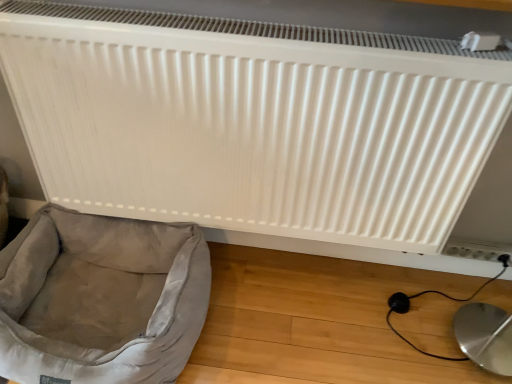
Question: Does white plastic electric outlet at lower right have a greater height compared to light gray fabric dog bed at lower left?

Choices:
 (A) yes
 (B) no

Answer: (B)

Question: Can you confirm if white plastic electric outlet at lower right is positioned to the right of light gray fabric dog bed at lower left?

Choices:
 (A) yes
 (B) no

Answer: (A)

Question: From the image's perspective, is white plastic electric outlet at lower right located beneath light gray fabric dog bed at lower left?

Choices:
 (A) no
 (B) yes

Answer: (A)

Question: Is the depth of white plastic electric outlet at lower right less than that of light gray fabric dog bed at lower left?

Choices:
 (A) no
 (B) yes

Answer: (A)

Question: From the image's perspective, would you say white plastic electric outlet at lower right is positioned over light gray fabric dog bed at lower left?

Choices:
 (A) yes
 (B) no

Answer: (A)

Question: Visually, is light gray fabric dog bed at lower left positioned to the left or to the right of white plastic electric outlet at lower right?

Choices:
 (A) right
 (B) left

Answer: (B)

Question: Is light gray fabric dog bed at lower left in front of or behind white plastic electric outlet at lower right in the image?

Choices:
 (A) behind
 (B) front

Answer: (B)

Question: Considering the positions of light gray fabric dog bed at lower left and white plastic electric outlet at lower right in the image, is light gray fabric dog bed at lower left taller or shorter than white plastic electric outlet at lower right?

Choices:
 (A) tall
 (B) short

Answer: (A)

Question: From a real-world perspective, is light gray fabric dog bed at lower left above or below white plastic electric outlet at lower right?

Choices:
 (A) below
 (B) above

Answer: (B)

Question: Considering the positions of white matte radiator at upper center and light gray fabric dog bed at lower left in the image, is white matte radiator at upper center bigger or smaller than light gray fabric dog bed at lower left?

Choices:
 (A) small
 (B) big

Answer: (A)

Question: From their relative heights in the image, would you say white matte radiator at upper center is taller or shorter than light gray fabric dog bed at lower left?

Choices:
 (A) short
 (B) tall

Answer: (B)

Question: Is white matte radiator at upper center inside or outside of light gray fabric dog bed at lower left?

Choices:
 (A) outside
 (B) inside

Answer: (A)

Question: Considering their positions, is white matte radiator at upper center located in front of or behind light gray fabric dog bed at lower left?

Choices:
 (A) front
 (B) behind

Answer: (A)

Question: Does point 114,223 appear closer or farther from the camera than point 434,155?

Choices:
 (A) closer
 (B) farther

Answer: (B)

Question: From a real-world perspective, is light gray fabric dog bed at lower left above or below white matte radiator at upper center?

Choices:
 (A) below
 (B) above

Answer: (A)